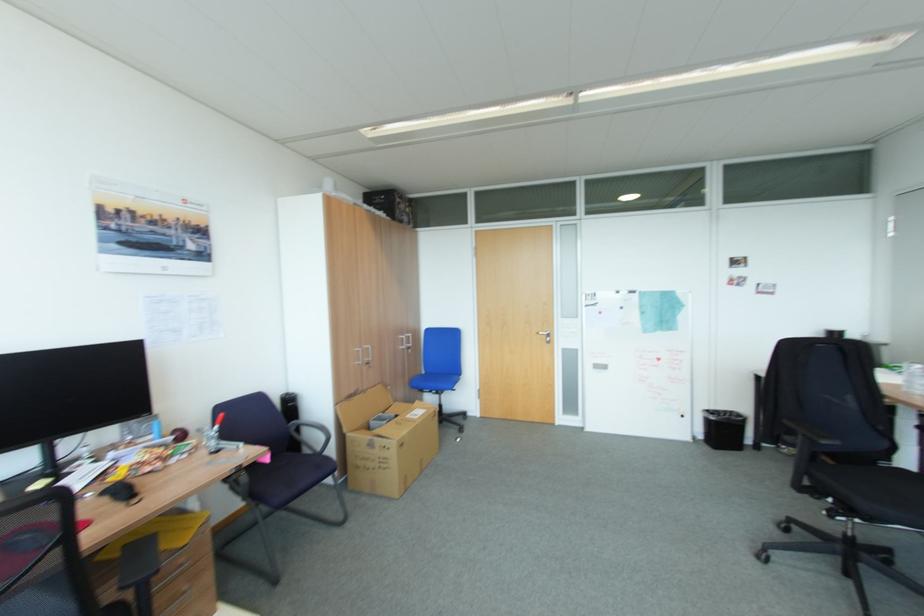
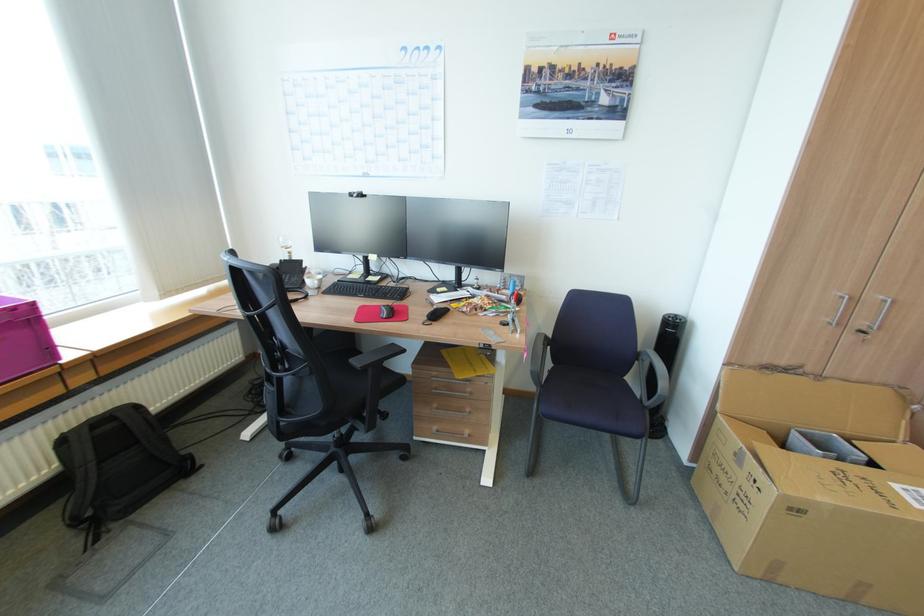
In the second image, find the point that corresponds to (373,346) in the first image.

(888, 297)